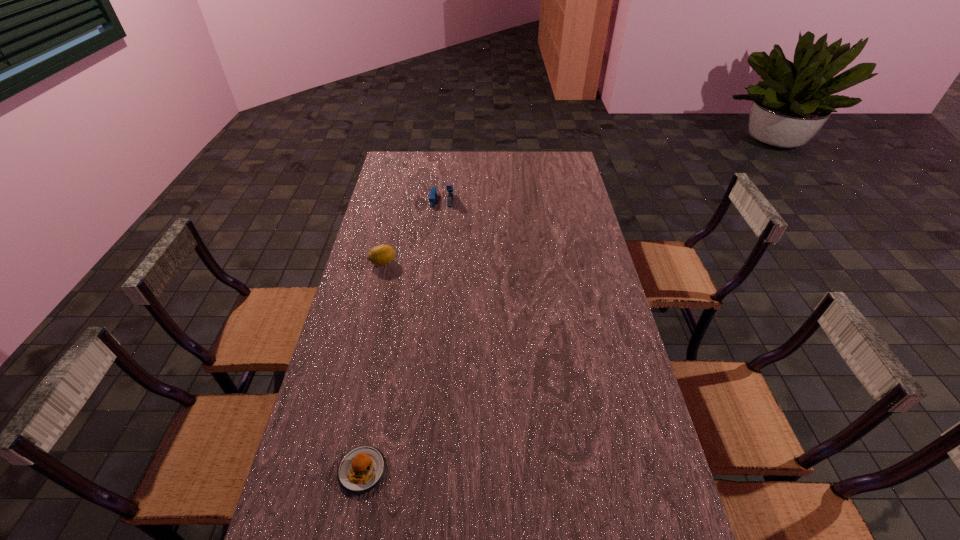
Locate an element on the screen. Image resolution: width=960 pixels, height=540 pixels. the farthest object is located at coordinates (432, 198).

I want to click on the tallest object, so click(x=432, y=198).

Where is `the second farthest object`? This screenshot has height=540, width=960. the second farthest object is located at coordinates tap(380, 255).

At what (x,y) coordinates should I click in order to perform the action: click on lemon. Please return your answer as a coordinate pair (x, y). This screenshot has width=960, height=540. Looking at the image, I should click on (380, 255).

At what (x,y) coordinates should I click in order to perform the action: click on the shortest object. Please return your answer as a coordinate pair (x, y). Image resolution: width=960 pixels, height=540 pixels. Looking at the image, I should click on (361, 469).

Where is `food`? Image resolution: width=960 pixels, height=540 pixels. food is located at coordinates (361, 469).

Where is `vacant region located 0.130m on the front of the tallest object`? Image resolution: width=960 pixels, height=540 pixels. vacant region located 0.130m on the front of the tallest object is located at coordinates (439, 226).

Locate an element on the screen. vacant position located at the stem end of the second shortest object is located at coordinates click(499, 262).

The image size is (960, 540). I want to click on free space located on the right of the shortest object, so click(538, 470).

Identify the location of lemon located in the left edge section of the desktop. This screenshot has height=540, width=960. (380, 255).